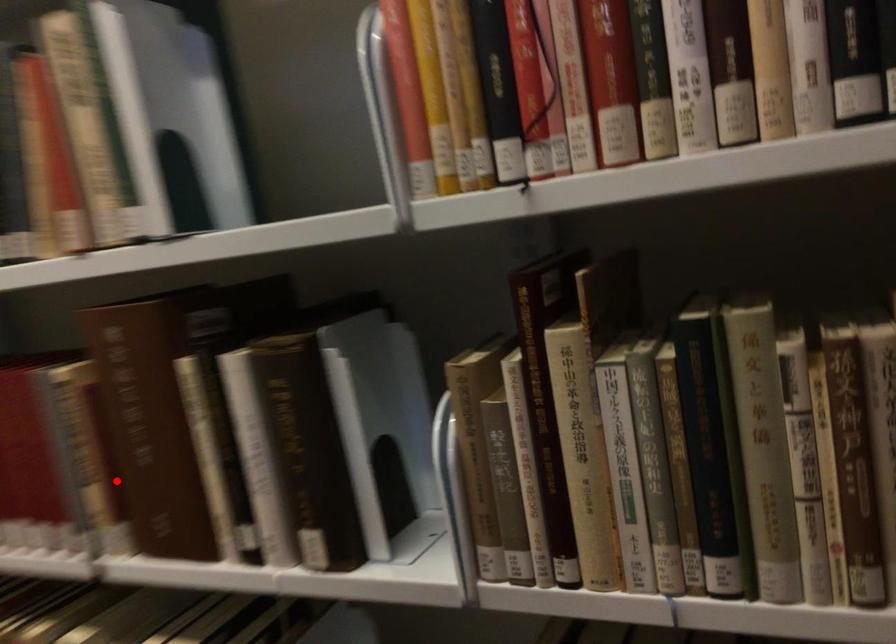
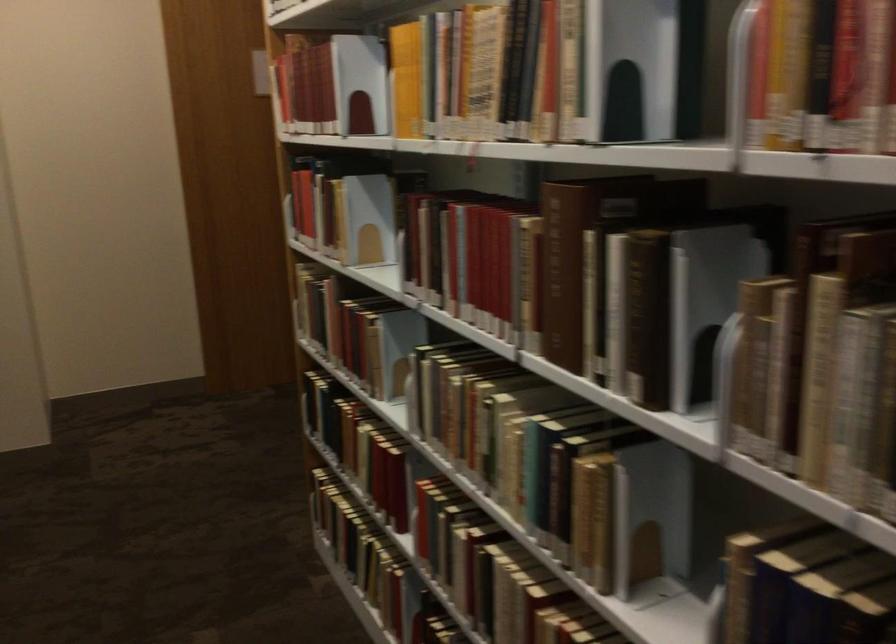
Find the pixel in the second image that matches the highlighted location in the first image.

(540, 299)